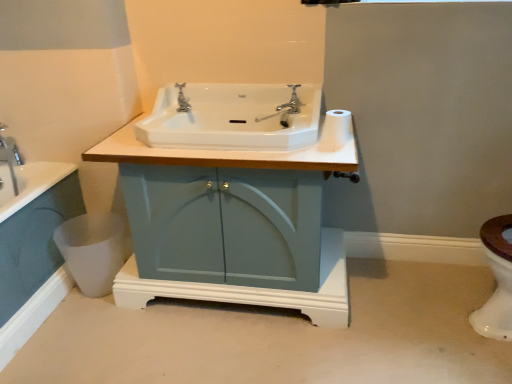
Where is `space that is in front of white matte toilet paper at upper right`? space that is in front of white matte toilet paper at upper right is located at coordinates pyautogui.click(x=331, y=148).